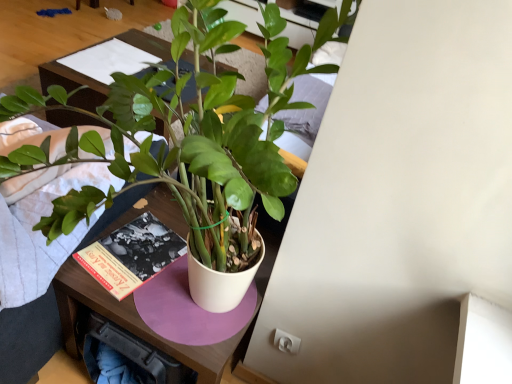
Question: In the image, is matte wood table at center on the left side or the right side of green glossy plant at center?

Choices:
 (A) right
 (B) left

Answer: (B)

Question: In terms of size, does matte wood table at center appear bigger or smaller than green glossy plant at center?

Choices:
 (A) big
 (B) small

Answer: (B)

Question: In terms of height, does matte wood table at center look taller or shorter compared to green glossy plant at center?

Choices:
 (A) tall
 (B) short

Answer: (B)

Question: Visually, is green glossy plant at center positioned to the left or to the right of matte wood table at center?

Choices:
 (A) right
 (B) left

Answer: (A)

Question: Considering the positions of point (53, 87) and point (202, 61), is point (53, 87) closer or farther from the camera than point (202, 61)?

Choices:
 (A) farther
 (B) closer

Answer: (B)

Question: In terms of width, does green glossy plant at center look wider or thinner when compared to matte wood table at center?

Choices:
 (A) thin
 (B) wide

Answer: (B)

Question: From the image's perspective, relative to matte wood table at center, is green glossy plant at center above or below?

Choices:
 (A) above
 (B) below

Answer: (B)